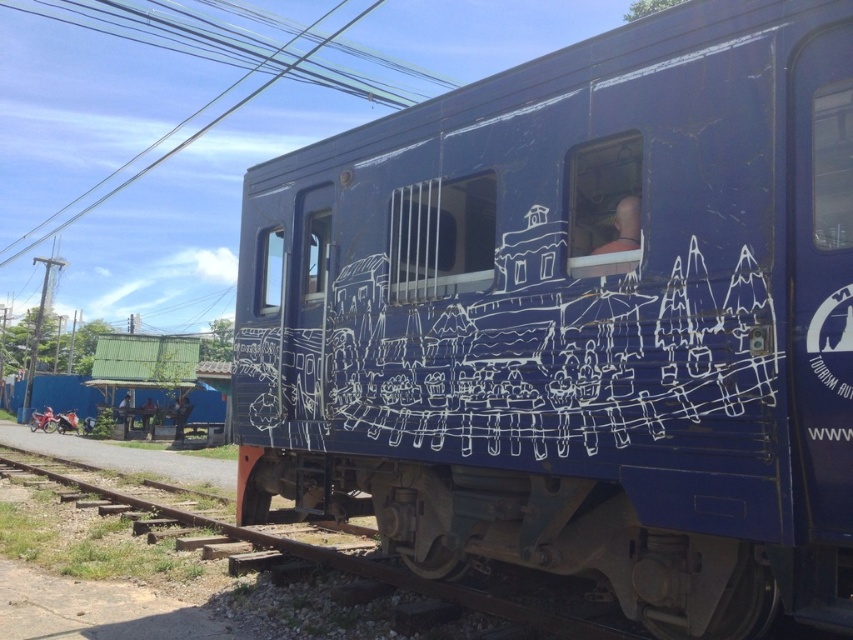
Question: Which object is the farthest from the metal/rough track at lower center?

Choices:
 (A) blue matte train at center
 (B) white chalk drawing at center

Answer: (A)

Question: Can you confirm if white chalk drawing at center is positioned below metal/rough track at lower center?

Choices:
 (A) yes
 (B) no

Answer: (B)

Question: Based on their relative distances, which object is farther from the white chalk drawing at center?

Choices:
 (A) metal/rough track at lower center
 (B) blue matte train at center

Answer: (A)

Question: Which object appears farthest from the camera in this image?

Choices:
 (A) blue matte train at center
 (B) white chalk drawing at center
 (C) metal/rough track at lower center

Answer: (C)

Question: Is blue matte train at center above white chalk drawing at center?

Choices:
 (A) yes
 (B) no

Answer: (B)

Question: From the image, what is the correct spatial relationship of blue matte train at center in relation to metal/rough track at lower center?

Choices:
 (A) left
 (B) right

Answer: (B)